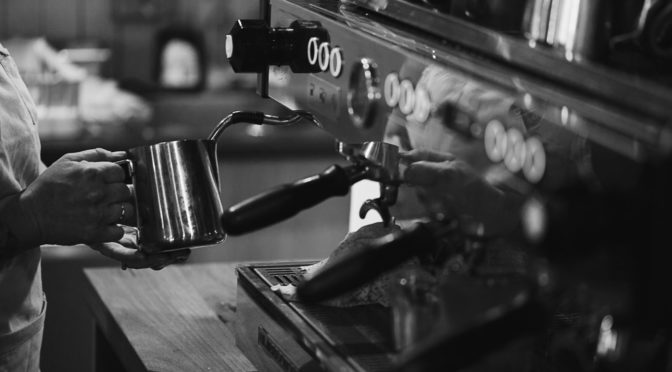
Where is `counter top`? The width and height of the screenshot is (672, 372). counter top is located at coordinates (x=175, y=322).